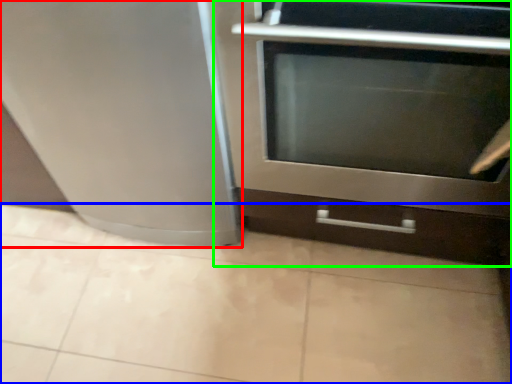
Question: Estimate the real-world distances between objects in this image. Which object is closer to appliance (highlighted by a red box), ceramic tile (highlighted by a blue box) or oven (highlighted by a green box)?

Choices:
 (A) ceramic tile
 (B) oven

Answer: (B)